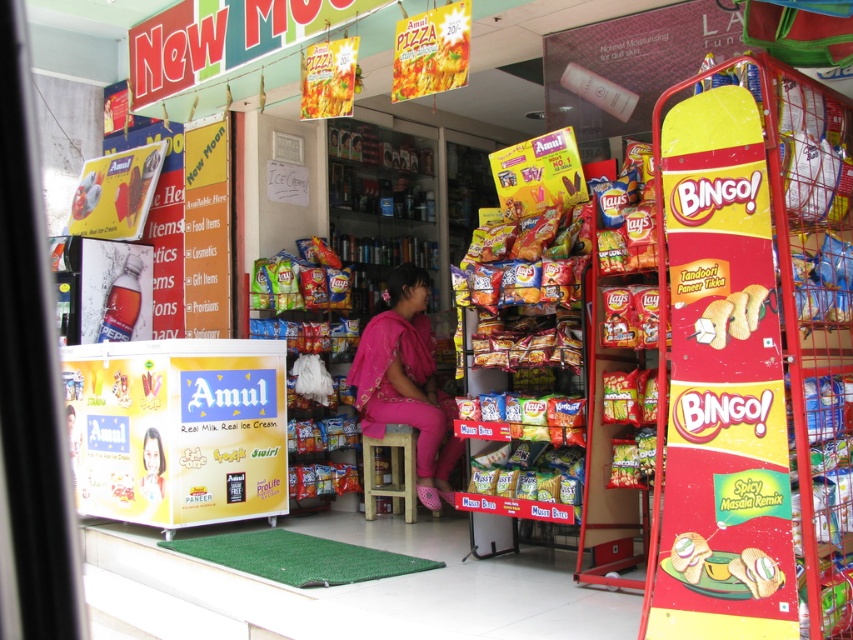
You are a customer in the store and want to reach the pink fabric dress at center. The wooden stool at center is in your way. Can you step over the stool to get to the dress?

The pink fabric dress at center is taller than the wooden stool at center, so stepping over the stool would not be possible since the dress is taller than the stool.

You are standing in the convenience store and want to reach the exit, which is located at point (149, 444). There is an obstacle at point (730, 333). Can you walk directly to the exit without going around the obstacle?

Point (730, 333) is in front of point (149, 444), so the obstacle is blocking the path to the exit. You will need to go around the obstacle to reach the exit.

You are a customer in the store and want to buy both the golden crispy bread at right and the smooth pink dress at center. However, your bag can only hold one item. Based on their sizes, which item should you choose to fit in your bag?

The golden crispy bread at right is wider than the smooth pink dress at center. Therefore, the smooth pink dress at center would fit better in your bag.